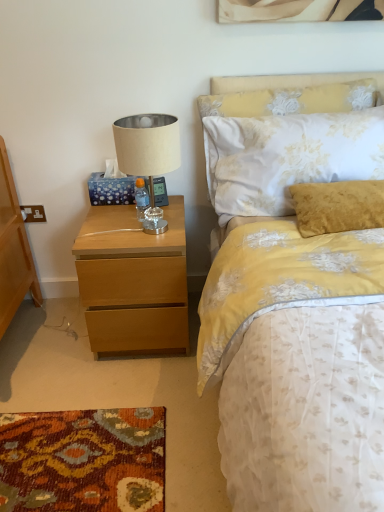
Question: Does beige fabric lampshade at upper left lie in front of light wood nightstand at left?

Choices:
 (A) no
 (B) yes

Answer: (B)

Question: Is beige fabric lampshade at upper left at the left side of light wood nightstand at left?

Choices:
 (A) no
 (B) yes

Answer: (A)

Question: Is beige fabric lampshade at upper left positioned far away from light wood nightstand at left?

Choices:
 (A) no
 (B) yes

Answer: (A)

Question: Considering the relative sizes of beige fabric lampshade at upper left and light wood nightstand at left in the image provided, is beige fabric lampshade at upper left bigger than light wood nightstand at left?

Choices:
 (A) yes
 (B) no

Answer: (B)

Question: From a real-world perspective, is beige fabric lampshade at upper left physically below light wood nightstand at left?

Choices:
 (A) yes
 (B) no

Answer: (B)

Question: Is beige fabric lampshade at upper left completely or partially outside of light wood nightstand at left?

Choices:
 (A) yes
 (B) no

Answer: (A)

Question: Is light wood nightstand at left far away from floral fabric pillow at upper right?

Choices:
 (A) yes
 (B) no

Answer: (B)

Question: From a real-world perspective, does light wood nightstand at left stand above floral fabric pillow at upper right?

Choices:
 (A) no
 (B) yes

Answer: (A)

Question: Is light wood nightstand at left positioned with its back to floral fabric pillow at upper right?

Choices:
 (A) yes
 (B) no

Answer: (B)

Question: From the image's perspective, does light wood nightstand at left appear lower than floral fabric pillow at upper right?

Choices:
 (A) yes
 (B) no

Answer: (A)

Question: Does light wood nightstand at left have a lesser width compared to floral fabric pillow at upper right?

Choices:
 (A) yes
 (B) no

Answer: (B)

Question: Are light wood nightstand at left and floral fabric pillow at upper right making contact?

Choices:
 (A) no
 (B) yes

Answer: (A)

Question: Considering the relative positions of beige fabric lampshade at upper left and floral fabric pillow at upper right in the image provided, is beige fabric lampshade at upper left to the left of floral fabric pillow at upper right from the viewer's perspective?

Choices:
 (A) yes
 (B) no

Answer: (A)